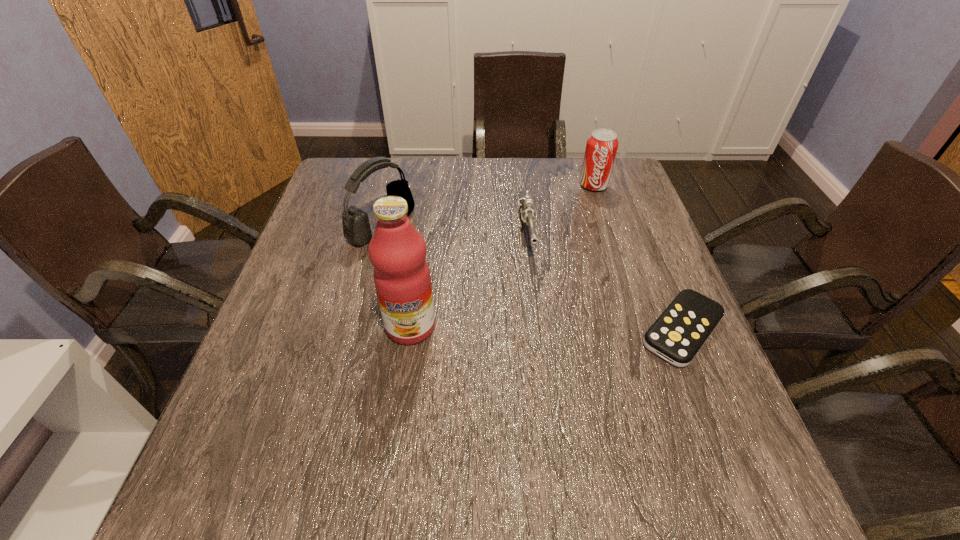
Image resolution: width=960 pixels, height=540 pixels. Identify the location of vacant space that satisfies the following two spatial constraints: 1. on the front side of the second tallest object; 2. on the left side of the shortest object. [356, 330].

At what (x,y) coordinates should I click in order to perform the action: click on blank area in the image that satisfies the following two spatial constraints: 1. on the back side of the fourth tallest object; 2. on the right side of the soda can. Please return your answer as a coordinate pair (x, y). The image size is (960, 540). Looking at the image, I should click on (521, 185).

Locate an element on the screen. free space in the image that satisfies the following two spatial constraints: 1. on the label of the shortest object; 2. on the right side of the tallest object is located at coordinates (x=410, y=330).